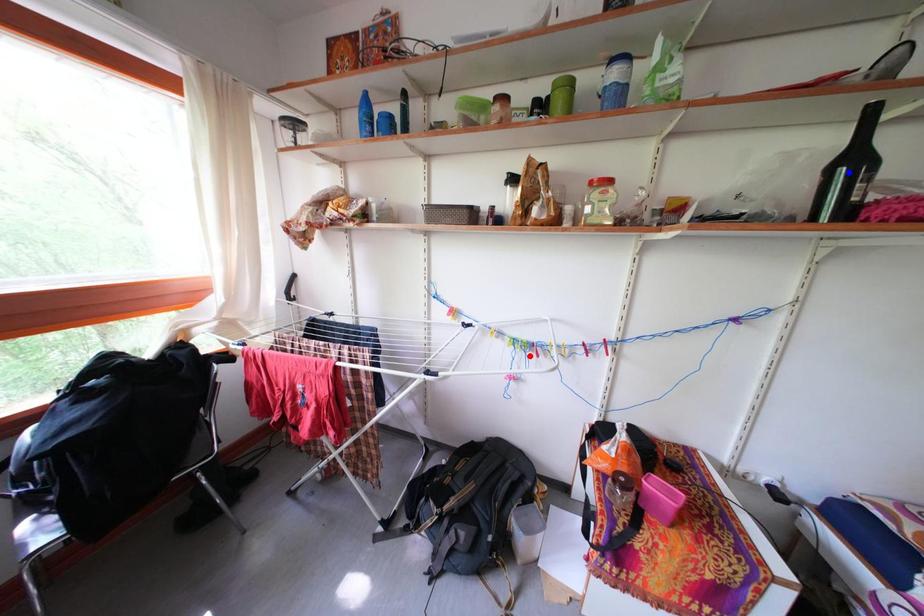
Question: In the image, two points are highlighted. Which point is nearer to the camera? Reply with the corresponding letter.

Choices:
 (A) blue point
 (B) red point

Answer: (A)